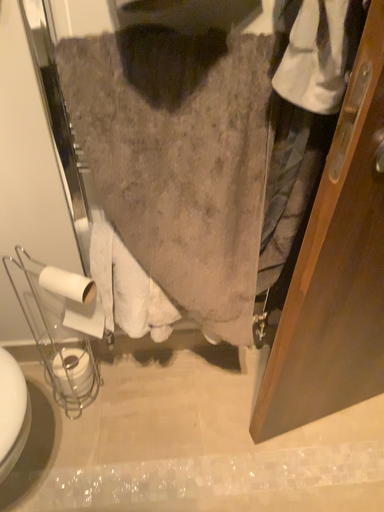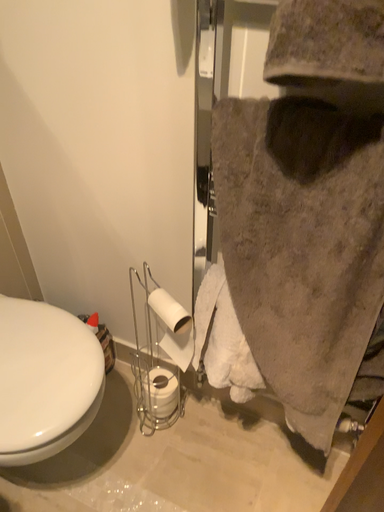
Question: Which way did the camera rotate in the video?

Choices:
 (A) rotated upward
 (B) rotated downward

Answer: (A)